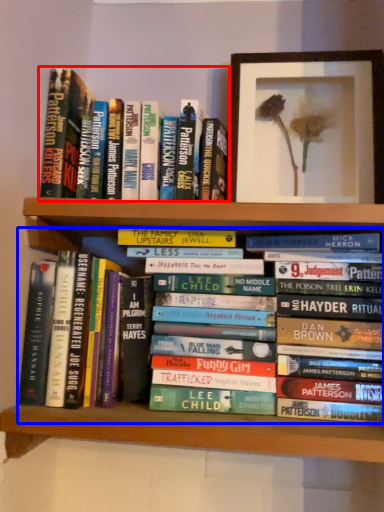
Question: Which object appears closest to the camera in this image, book (highlighted by a red box) or book (highlighted by a blue box)?

Choices:
 (A) book
 (B) book

Answer: (B)